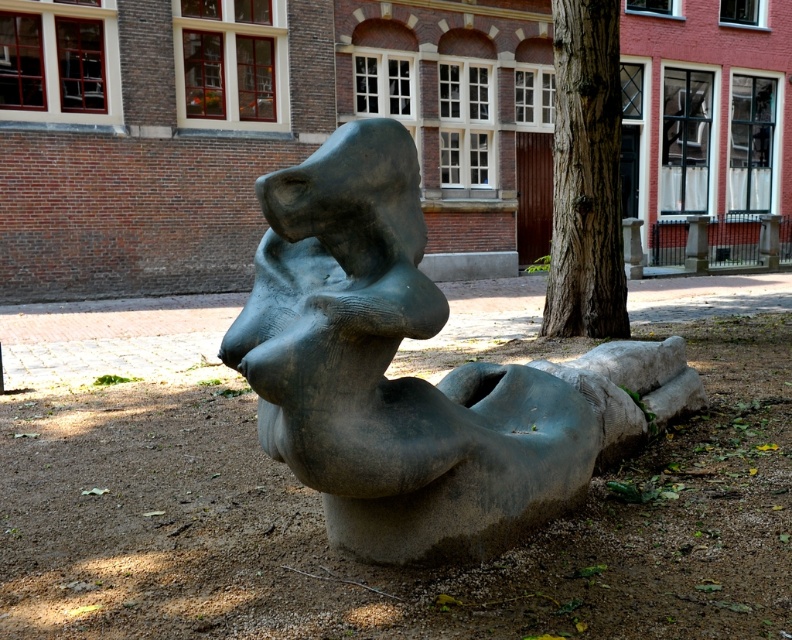
At what (x,y) coordinates should I click in order to perform the action: click on matte gray stone sculpture at center. Please return your answer as a coordinate pair (x, y). This screenshot has width=792, height=640. Looking at the image, I should click on (410, 376).

In the scene shown: Which of these two, matte gray stone sculpture at center or smooth brown tree trunk at center, stands taller?

Standing taller between the two is smooth brown tree trunk at center.

Does point (688, 406) lie behind point (596, 52)?

No, it is in front of (596, 52).

Locate an element on the screen. matte gray stone sculpture at center is located at coordinates (410, 376).